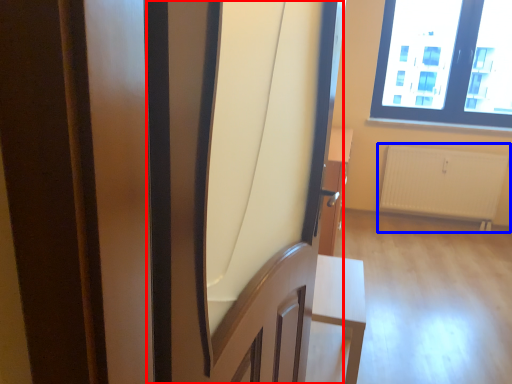
Question: Among these objects, which one is farthest to the camera, screen door (highlighted by a red box) or radiator (highlighted by a blue box)?

Choices:
 (A) screen door
 (B) radiator

Answer: (B)